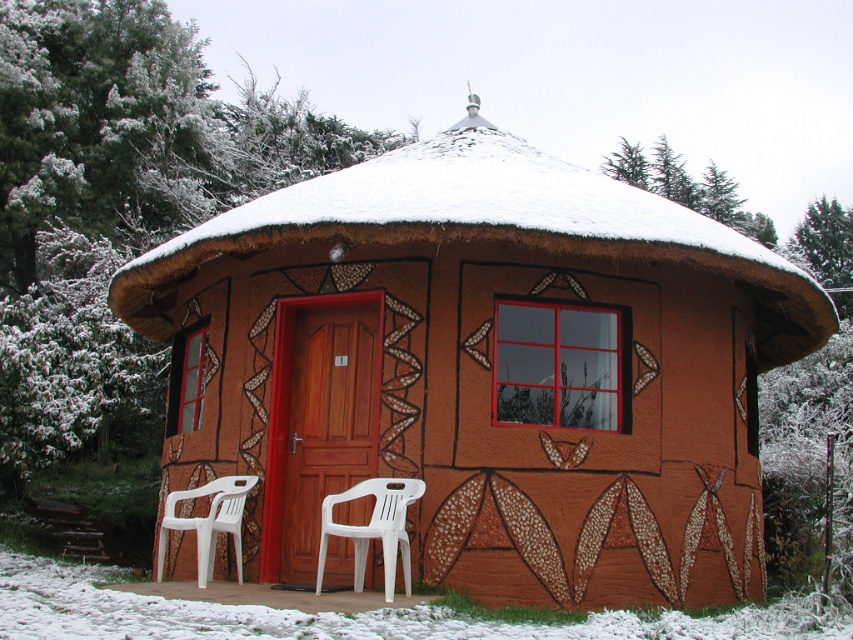
You are standing in the snowy environment and want to locate the brown textured hut at center. Based on the coordinates provided, where would you find it?

The brown textured hut at center is located at the coordinates point (483,371).